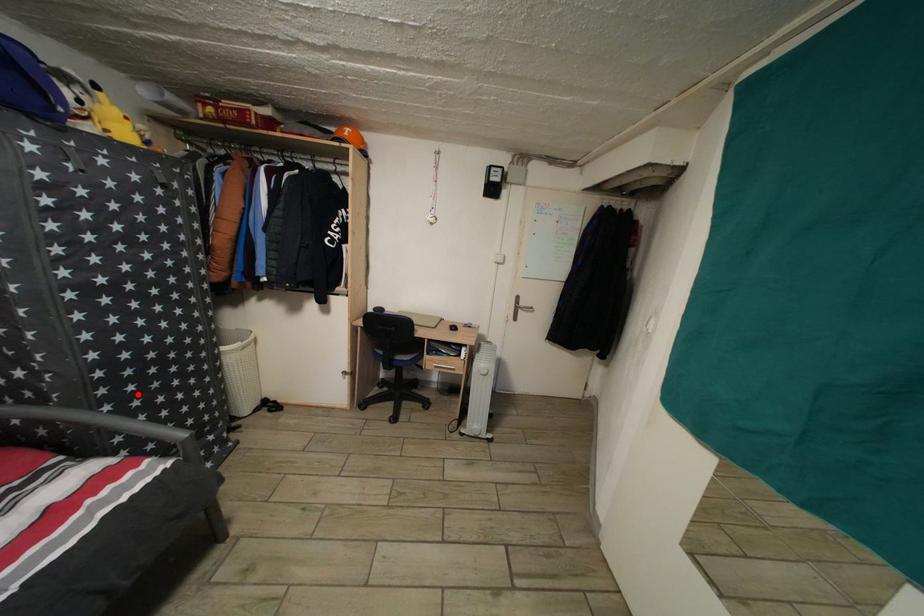
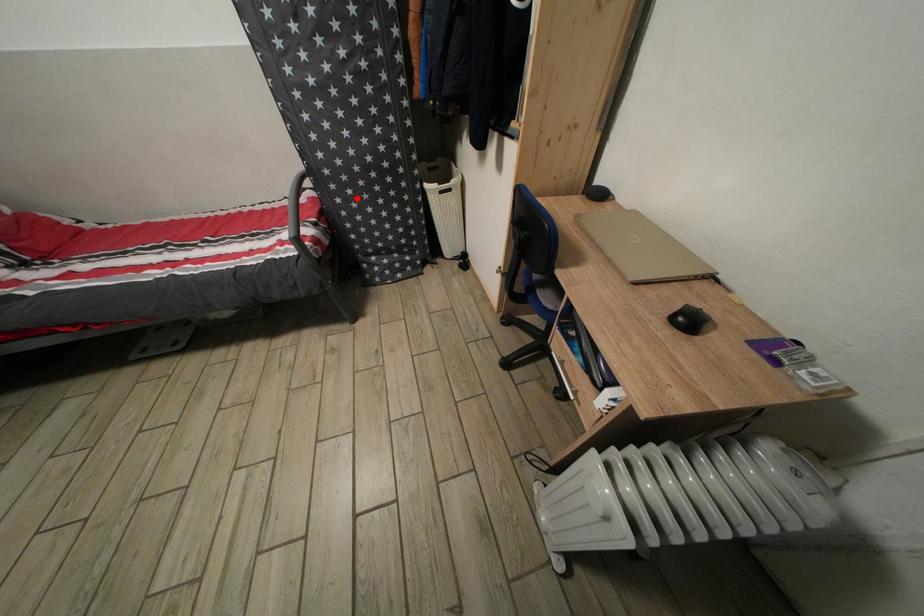
I am providing you with two images of the same scene from different viewpoints. A red point is marked on the first image and another point is marked on the second image. Do the highlighted points in image1 and image2 indicate the same real-world spot?

Yes